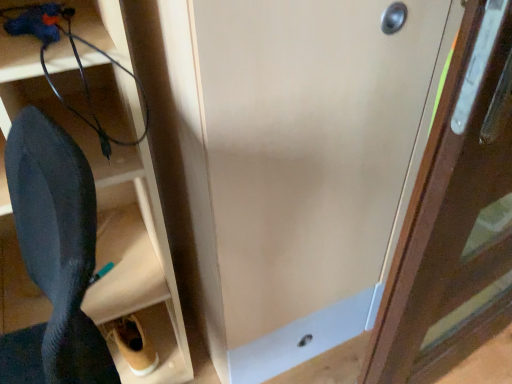
Question: Considering the relative positions of black matte shoe at lower left and black rubber wire at lower left in the image provided, is black matte shoe at lower left in front of black rubber wire at lower left?

Choices:
 (A) yes
 (B) no

Answer: (A)

Question: From the image's perspective, is black matte shoe at lower left under black rubber wire at lower left?

Choices:
 (A) no
 (B) yes

Answer: (B)

Question: Is black matte shoe at lower left smaller than black rubber wire at lower left?

Choices:
 (A) yes
 (B) no

Answer: (B)

Question: Does black matte shoe at lower left have a greater height compared to black rubber wire at lower left?

Choices:
 (A) no
 (B) yes

Answer: (B)

Question: Is black matte shoe at lower left thinner than black rubber wire at lower left?

Choices:
 (A) yes
 (B) no

Answer: (B)

Question: Considering the positions of point (95, 119) and point (276, 21), is point (95, 119) closer or farther from the camera than point (276, 21)?

Choices:
 (A) closer
 (B) farther

Answer: (B)

Question: Choose the correct answer: Is black rubber wire at lower left inside matte wood door at center, the second door viewed from the right, or outside it?

Choices:
 (A) inside
 (B) outside

Answer: (B)

Question: From a real-world perspective, is black rubber wire at lower left positioned above or below matte wood door at center, which ranks as the first door in left-to-right order?

Choices:
 (A) above
 (B) below

Answer: (A)

Question: Is black rubber wire at lower left wider or thinner than matte wood door at center, the second door viewed from the right?

Choices:
 (A) wide
 (B) thin

Answer: (B)

Question: Is black matte shoe at lower left in front of or behind wooden door at right, which ranks as the 1th door in right-to-left order, in the image?

Choices:
 (A) behind
 (B) front

Answer: (B)

Question: In terms of width, does black matte shoe at lower left look wider or thinner when compared to wooden door at right, the 2th door when ordered from left to right?

Choices:
 (A) thin
 (B) wide

Answer: (A)

Question: Considering the relative positions of black matte shoe at lower left and wooden door at right, which ranks as the 1th door in right-to-left order, in the image provided, is black matte shoe at lower left to the left or to the right of wooden door at right, which ranks as the 1th door in right-to-left order,?

Choices:
 (A) right
 (B) left

Answer: (B)

Question: From a real-world perspective, is black matte shoe at lower left positioned above or below wooden door at right, the 2th door when ordered from left to right?

Choices:
 (A) below
 (B) above

Answer: (A)

Question: From the image's perspective, is wooden door at right, the 2th door when ordered from left to right, located above or below matte wood door at center, the second door viewed from the right?

Choices:
 (A) above
 (B) below

Answer: (B)

Question: Is point (419, 352) closer or farther from the camera than point (305, 266)?

Choices:
 (A) farther
 (B) closer

Answer: (A)